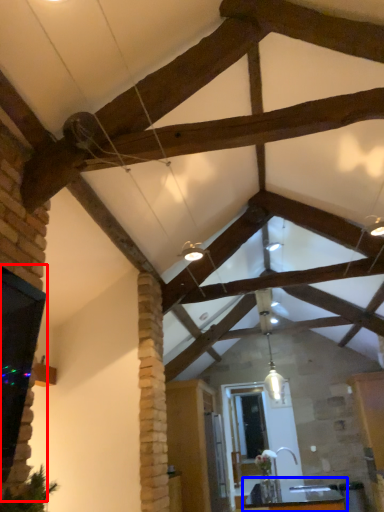
Question: Which object appears closest to the camera in this image, window (highlighted by a red box) or table (highlighted by a blue box)?

Choices:
 (A) window
 (B) table

Answer: (A)